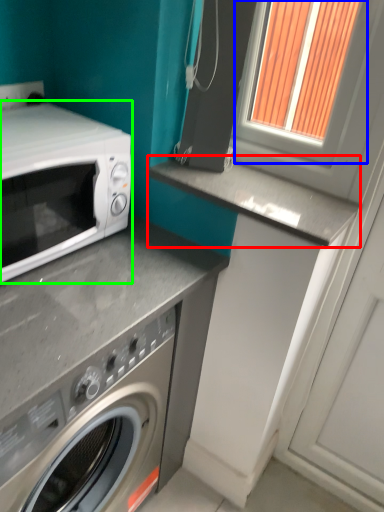
Question: Considering the real-world distances, which object is farthest from counter top (highlighted by a red box)? window frame (highlighted by a blue box) or microwave oven (highlighted by a green box)?

Choices:
 (A) window frame
 (B) microwave oven

Answer: (B)